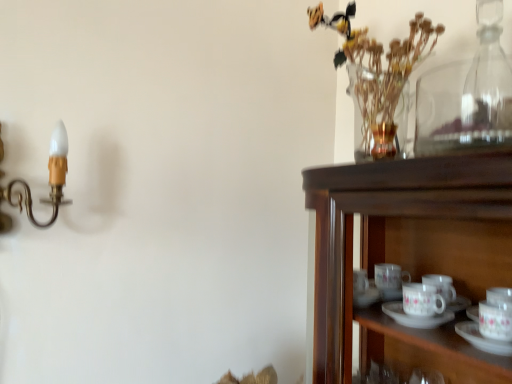
The width and height of the screenshot is (512, 384). What do you see at coordinates (488, 75) in the screenshot?
I see `transparent glass bottle at upper right` at bounding box center [488, 75].

At what (x,y) coordinates should I click in order to perform the action: click on clear glass vase at upper right. Please return your answer as a coordinate pair (x, y). Looking at the image, I should click on (378, 72).

Can you tell me how much transparent glass bottle at upper right and clear glass vase at upper right differ in facing direction?

They differ by 0.569 degrees in their facing directions.

From a real-world perspective, is transparent glass bottle at upper right above or below clear glass vase at upper right?

transparent glass bottle at upper right is situated lower than clear glass vase at upper right in the real world.

From the picture: From the image's perspective, which one is positioned lower, transparent glass bottle at upper right or clear glass vase at upper right?

transparent glass bottle at upper right, from the image's perspective.

Which is more to the right, transparent glass bottle at upper right or gold brass candle holder at left?

Positioned to the right is transparent glass bottle at upper right.

Is transparent glass bottle at upper right bigger or smaller than gold brass candle holder at left?

Clearly, transparent glass bottle at upper right is smaller in size than gold brass candle holder at left.

Which object is closer to the camera, transparent glass bottle at upper right or gold brass candle holder at left?

gold brass candle holder at left.

Which object is positioned more to the left, gold brass candle holder at left or clear glass vase at upper right?

gold brass candle holder at left is more to the left.

In the scene shown: From the image's perspective, is gold brass candle holder at left positioned above or below clear glass vase at upper right?

Based on their image positions, gold brass candle holder at left is located beneath clear glass vase at upper right.

Could you tell me if gold brass candle holder at left is turned towards clear glass vase at upper right?

No, gold brass candle holder at left is not turned towards clear glass vase at upper right.

Is gold brass candle holder at left spatially inside clear glass vase at upper right, or outside of it?

gold brass candle holder at left is not inside clear glass vase at upper right, it's outside.

From a real-world perspective, does gold brass candle holder at left stand above transparent glass bottle at upper right?

No, from a real-world perspective, gold brass candle holder at left is not over transparent glass bottle at upper right

Which object is closer to the camera taking this photo, gold brass candle holder at left or transparent glass bottle at upper right?

Positioned in front is gold brass candle holder at left.

Is gold brass candle holder at left aimed at transparent glass bottle at upper right?

Answer: No, gold brass candle holder at left does not turn towards transparent glass bottle at upper right.

Does gold brass candle holder at left contain transparent glass bottle at upper right?

Actually, transparent glass bottle at upper right is outside gold brass candle holder at left.

Is clear glass vase at upper right surrounding transparent glass bottle at upper right?

No, clear glass vase at upper right does not contain transparent glass bottle at upper right.

Is clear glass vase at upper right facing towards transparent glass bottle at upper right?

No, clear glass vase at upper right is not aimed at transparent glass bottle at upper right.

From a real-world perspective, which object rests below the other?

transparent glass bottle at upper right is physically lower.

Looking at their sizes, would you say clear glass vase at upper right is wider or thinner than transparent glass bottle at upper right?

clear glass vase at upper right is wider than transparent glass bottle at upper right.

From a real-world perspective, between clear glass vase at upper right and gold brass candle holder at left, who is vertically higher?

In real-world perspective, clear glass vase at upper right is above.

Based on the photo, who is smaller, clear glass vase at upper right or gold brass candle holder at left?

With smaller size is gold brass candle holder at left.

Can you tell me how much clear glass vase at upper right and gold brass candle holder at left differ in facing direction?

clear glass vase at upper right and gold brass candle holder at left are facing 89.1 degrees away from each other.

Would you say clear glass vase at upper right is outside gold brass candle holder at left?

Yes, clear glass vase at upper right is located beyond the bounds of gold brass candle holder at left.

Image resolution: width=512 pixels, height=384 pixels. What are the coordinates of `floral arrangement located above the transparent glass bottle at upper right (from a real-world perspective)` in the screenshot? It's located at (378, 72).

At what (x,y) coordinates should I click in order to perform the action: click on candle holder below the transparent glass bottle at upper right (from the image's perspective). Please return your answer as a coordinate pair (x, y). The image size is (512, 384). Looking at the image, I should click on (49, 179).

Considering their positions, is transparent glass bottle at upper right positioned closer to clear glass vase at upper right than gold brass candle holder at left?

Based on the image, transparent glass bottle at upper right appears to be nearer to clear glass vase at upper right.

Which object lies further to the anchor point gold brass candle holder at left, clear glass vase at upper right or transparent glass bottle at upper right?

transparent glass bottle at upper right is further to gold brass candle holder at left.

When comparing their distances from transparent glass bottle at upper right, does clear glass vase at upper right or gold brass candle holder at left seem closer?

clear glass vase at upper right.

Based on their spatial positions, is gold brass candle holder at left or clear glass vase at upper right further from transparent glass bottle at upper right?

gold brass candle holder at left.

From the image, which object appears to be farther from gold brass candle holder at left, transparent glass bottle at upper right or clear glass vase at upper right?

transparent glass bottle at upper right lies further to gold brass candle holder at left than the other object.

From the picture: Considering their positions, is gold brass candle holder at left positioned closer to clear glass vase at upper right than transparent glass bottle at upper right?

transparent glass bottle at upper right is closer to clear glass vase at upper right.

I want to click on floral arrangement between gold brass candle holder at left and transparent glass bottle at upper right in the horizontal direction, so click(378, 72).